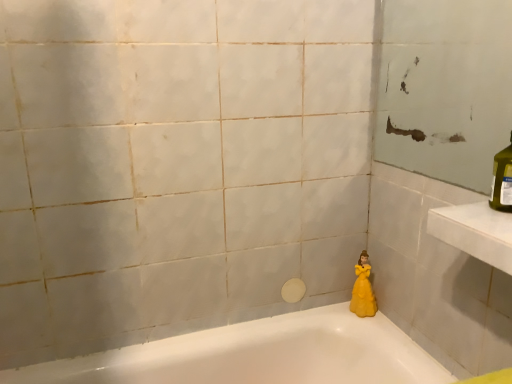
What do you see at coordinates (259, 355) in the screenshot?
I see `white glossy bathtub at lower right` at bounding box center [259, 355].

Identify the location of white glossy bathtub at lower right. The image size is (512, 384). (259, 355).

Measure the distance between point (354, 360) and camera.

Point (354, 360) and camera are 4.32 feet apart.

What is the approximate width of white glossy bathtub at lower right?

It is 16.26 inches.

Identify the location of yellow matte doll at lower right. This screenshot has height=384, width=512. (362, 289).

What do you see at coordinates (362, 289) in the screenshot? I see `yellow matte doll at lower right` at bounding box center [362, 289].

In order to face yellow matte doll at lower right, should I rotate leftwards or rightwards?

You should look right and rotate roughly 14.236 degrees.

In the scene shown: Measure the distance between yellow matte doll at lower right and camera.

yellow matte doll at lower right is 4.51 feet from camera.

In order to click on white glossy bathtub at lower right in this screenshot , I will do `click(259, 355)`.

Would you say white glossy bathtub at lower right is to the left or to the right of yellow matte doll at lower right in the picture?

Clearly, white glossy bathtub at lower right is on the left of yellow matte doll at lower right in the image.

Which object is further away from the camera, white glossy bathtub at lower right or yellow matte doll at lower right?

yellow matte doll at lower right is further away from the camera.

Is point (307, 356) less distant than point (373, 307)?

Yes, it is.

In the scene shown: From the image's perspective, which is below, white glossy bathtub at lower right or yellow matte doll at lower right?

white glossy bathtub at lower right.

From a real-world perspective, which object rests below the other?

white glossy bathtub at lower right is physically lower.

Is white glossy bathtub at lower right thinner than yellow matte doll at lower right?

Incorrect, the width of white glossy bathtub at lower right is not less than that of yellow matte doll at lower right.

Considering the sizes of white glossy bathtub at lower right and yellow matte doll at lower right in the image, is white glossy bathtub at lower right taller or shorter than yellow matte doll at lower right?

Clearly, white glossy bathtub at lower right is taller compared to yellow matte doll at lower right.

Who is bigger, white glossy bathtub at lower right or yellow matte doll at lower right?

white glossy bathtub at lower right is bigger.

Is white glossy bathtub at lower right located outside yellow matte doll at lower right?

white glossy bathtub at lower right is positioned outside yellow matte doll at lower right.

Is white glossy bathtub at lower right in contact with yellow matte doll at lower right?

white glossy bathtub at lower right and yellow matte doll at lower right are clearly separated.

Is white glossy bathtub at lower right looking in the opposite direction of yellow matte doll at lower right?

No, white glossy bathtub at lower right is not facing away from yellow matte doll at lower right.

What's the angular difference between white glossy bathtub at lower right and yellow matte doll at lower right's facing directions?

white glossy bathtub at lower right and yellow matte doll at lower right are facing 21.7 degrees away from each other.

Locate an element on the screen. This screenshot has width=512, height=384. bathtub located in front of the yellow matte doll at lower right is located at coordinates (259, 355).

Considering the positions of objects yellow matte doll at lower right and white glossy bathtub at lower right in the image provided, who is more to the left, yellow matte doll at lower right or white glossy bathtub at lower right?

From the viewer's perspective, white glossy bathtub at lower right appears more on the left side.

Which object is closer to the camera taking this photo, yellow matte doll at lower right or white glossy bathtub at lower right?

Positioned in front is white glossy bathtub at lower right.

Is point (367, 292) positioned behind point (373, 325)?

Yes, point (367, 292) is farther from viewer.

From the image's perspective, relative to white glossy bathtub at lower right, is yellow matte doll at lower right above or below?

From the image's perspective, yellow matte doll at lower right appears above white glossy bathtub at lower right.

From a real-world perspective, is yellow matte doll at lower right located beneath white glossy bathtub at lower right?

No, from a real-world perspective, yellow matte doll at lower right is not beneath white glossy bathtub at lower right.

Looking at their sizes, would you say yellow matte doll at lower right is wider or thinner than white glossy bathtub at lower right?

In the image, yellow matte doll at lower right appears to be more narrow than white glossy bathtub at lower right.

Between yellow matte doll at lower right and white glossy bathtub at lower right, which one has less height?

With less height is yellow matte doll at lower right.

Considering the sizes of objects yellow matte doll at lower right and white glossy bathtub at lower right in the image provided, who is smaller, yellow matte doll at lower right or white glossy bathtub at lower right?

yellow matte doll at lower right.

Is yellow matte doll at lower right located outside white glossy bathtub at lower right?

yellow matte doll at lower right is positioned outside white glossy bathtub at lower right.

Looking at this image, is yellow matte doll at lower right in contact with white glossy bathtub at lower right?

No, yellow matte doll at lower right is not next to white glossy bathtub at lower right.

Is yellow matte doll at lower right aimed at white glossy bathtub at lower right?

No, yellow matte doll at lower right is not oriented towards white glossy bathtub at lower right.

Where is `doll behind the white glossy bathtub at lower right`? doll behind the white glossy bathtub at lower right is located at coordinates (362, 289).

Identify the location of doll to the right of white glossy bathtub at lower right. This screenshot has width=512, height=384. (362, 289).

You are a GUI agent. You are given a task and a screenshot of the screen. Output one action in this format:
    pyautogui.click(x=<x>, y=<y>)
    Task: Click on the doll above the white glossy bathtub at lower right (from a real-world perspective)
    The height and width of the screenshot is (384, 512).
    Given the screenshot: What is the action you would take?
    pyautogui.click(x=362, y=289)